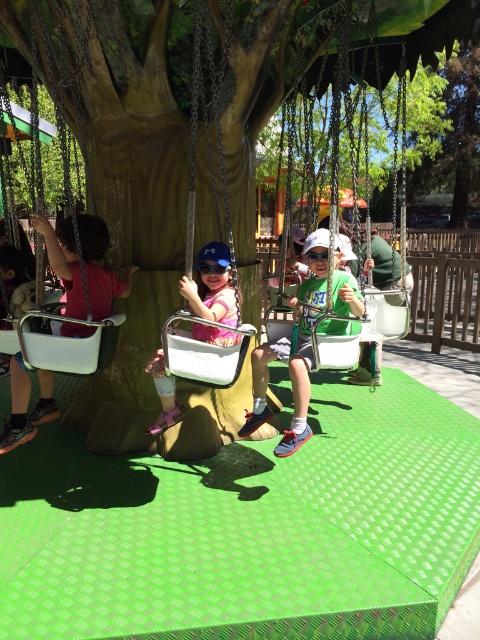
You are a parent at the playground. You see the green matte shirt at center and the white plastic swing at center. Which object is located below the other?

The green matte shirt at center is positioned under the white plastic swing at center, so the shirt is below the swing.